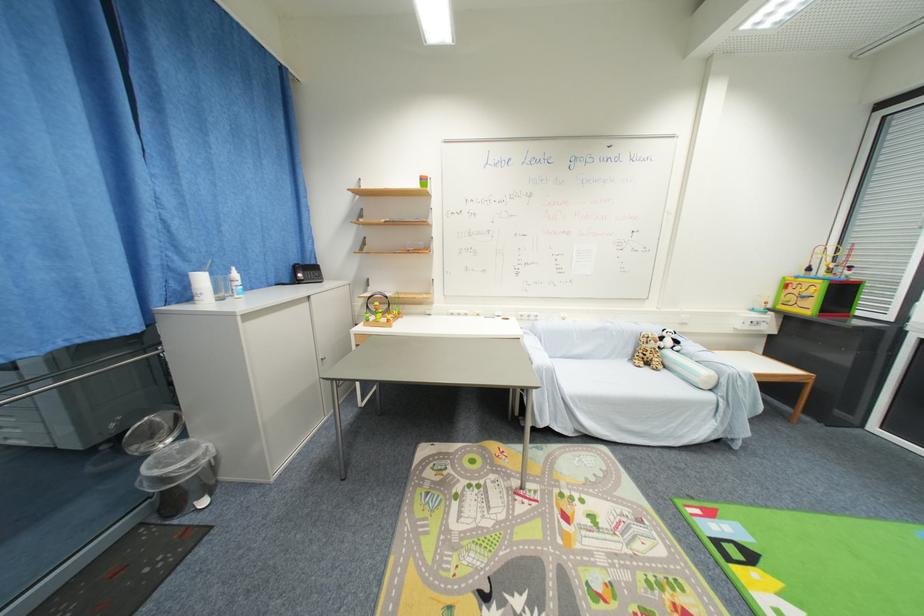
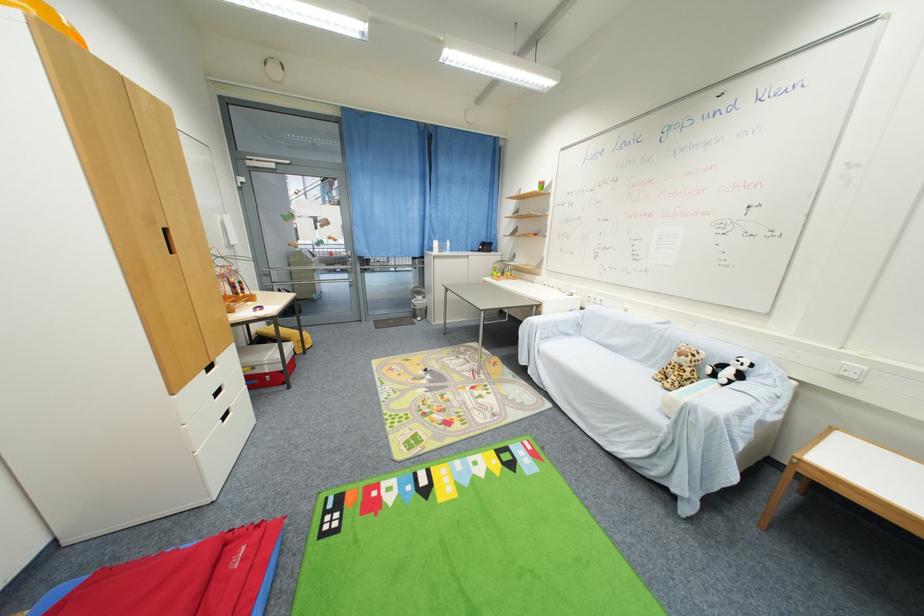
Where in the second image is the point corresponding to (660,365) from the first image?

(675, 382)